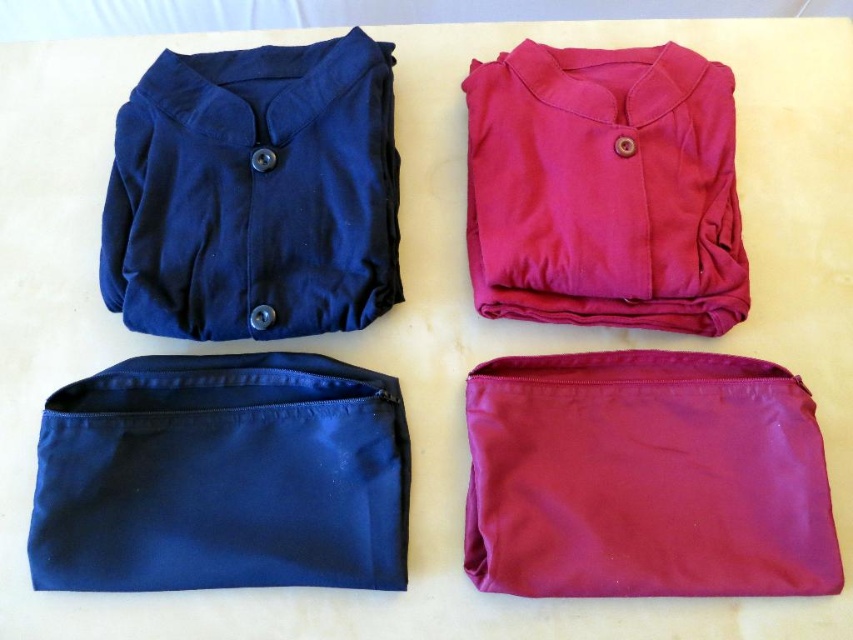
How much distance is there between navy blue fabric pouch at lower left and matte blue fabric shirt at upper left?

7.96 inches

Which of these two, navy blue fabric pouch at lower left or matte blue fabric shirt at upper left, stands taller?

matte blue fabric shirt at upper left

This screenshot has height=640, width=853. In order to click on navy blue fabric pouch at lower left in this screenshot , I will do `click(221, 476)`.

Is the position of matte purple pouch at bottom right less distant than that of navy blue fabric pouch at lower left?

Yes, it is in front of navy blue fabric pouch at lower left.

Does point (727, 480) come in front of point (347, 480)?

That is True.

Locate an element on the screen. matte purple pouch at bottom right is located at coordinates (645, 477).

Is navy blue fabric pouch at lower left shorter than matte pink fabric shirt at upper right?

Correct, navy blue fabric pouch at lower left is not as tall as matte pink fabric shirt at upper right.

From the picture: Which of these two, navy blue fabric pouch at lower left or matte pink fabric shirt at upper right, stands taller?

matte pink fabric shirt at upper right

Is point (248, 394) closer to camera compared to point (657, 104)?

Yes, it is.

Identify the location of navy blue fabric pouch at lower left. The image size is (853, 640). (221, 476).